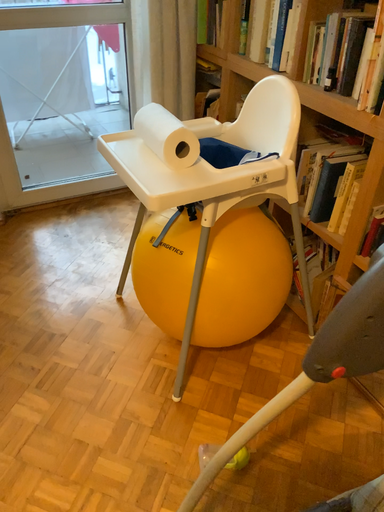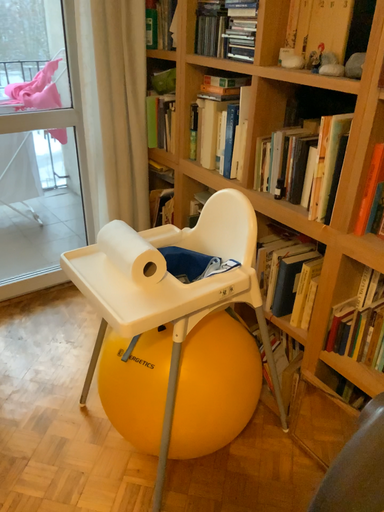
Question: How did the camera likely rotate when shooting the video?

Choices:
 (A) rotated upward
 (B) rotated downward

Answer: (A)